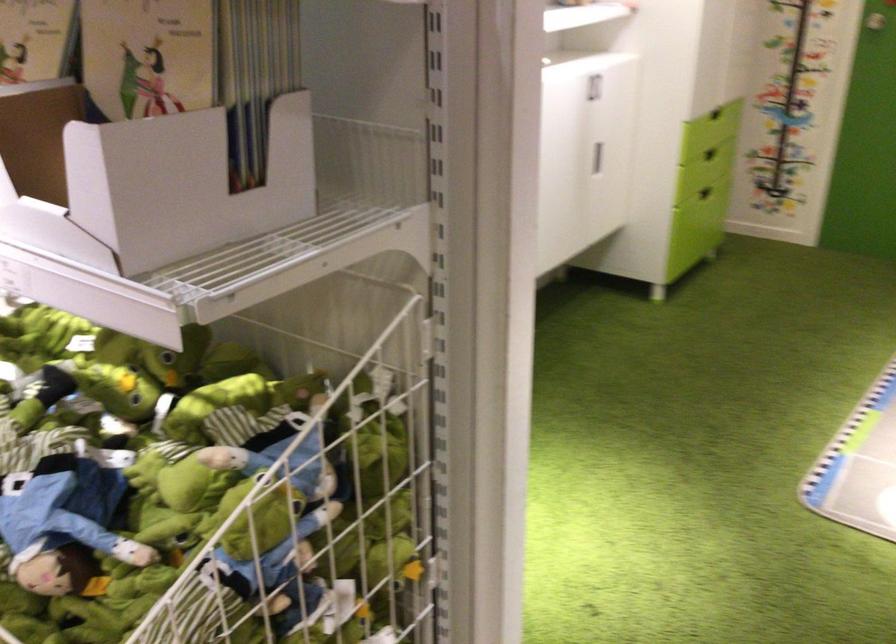
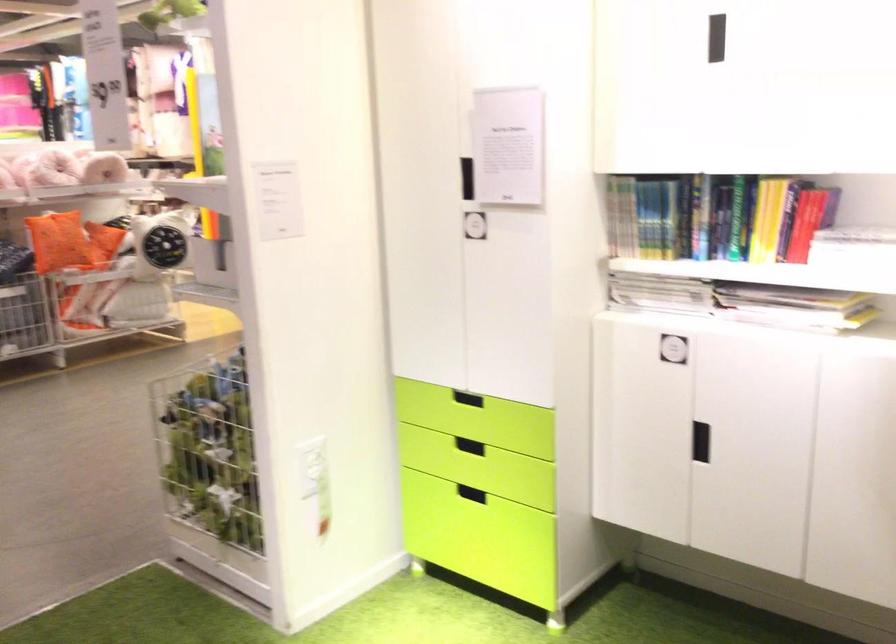
Question: I am providing you with two images of the same scene from different viewpoints. After the viewpoint changes to image2, which objects are now occluded?

Choices:
 (A) stuffed frog toy
 (B) black cabinet handle
 (C) orange square pillow
 (D) grey drawer pull

Answer: (A)